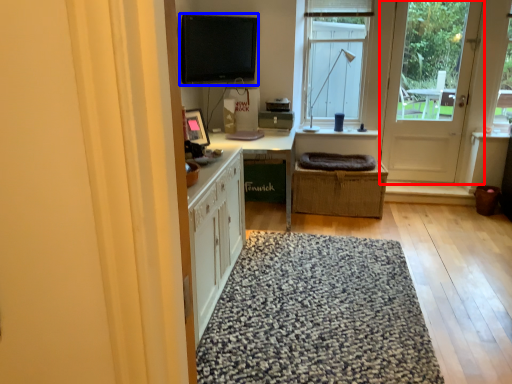
Question: Which of the following is the farthest to the observer, door (highlighted by a red box) or computer monitor (highlighted by a blue box)?

Choices:
 (A) door
 (B) computer monitor

Answer: (A)